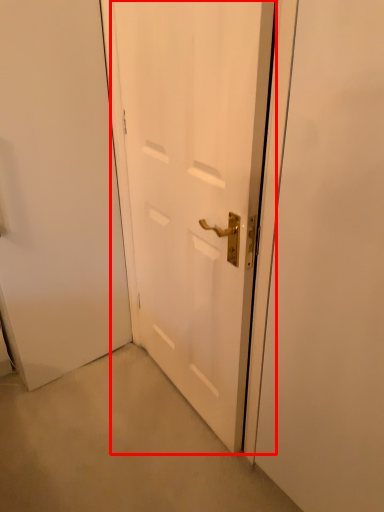
Question: From the image's perspective, what is the correct spatial positioning of door (annotated by the red box) in reference to screen door?

Choices:
 (A) below
 (B) above

Answer: (B)